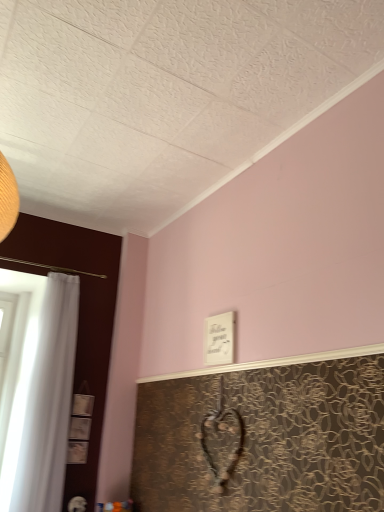
You are a GUI agent. You are given a task and a screenshot of the screen. Output one action in this format:
    pyautogui.click(x=<x>, y=<y>)
    Task: Click on the white sheer curtain at left
    This screenshot has height=512, width=384.
    Given the screenshot: What is the action you would take?
    pyautogui.click(x=41, y=395)

The image size is (384, 512). What do you see at coordinates (41, 395) in the screenshot?
I see `white sheer curtain at left` at bounding box center [41, 395].

The width and height of the screenshot is (384, 512). I want to click on white sheer curtain at left, so click(x=41, y=395).